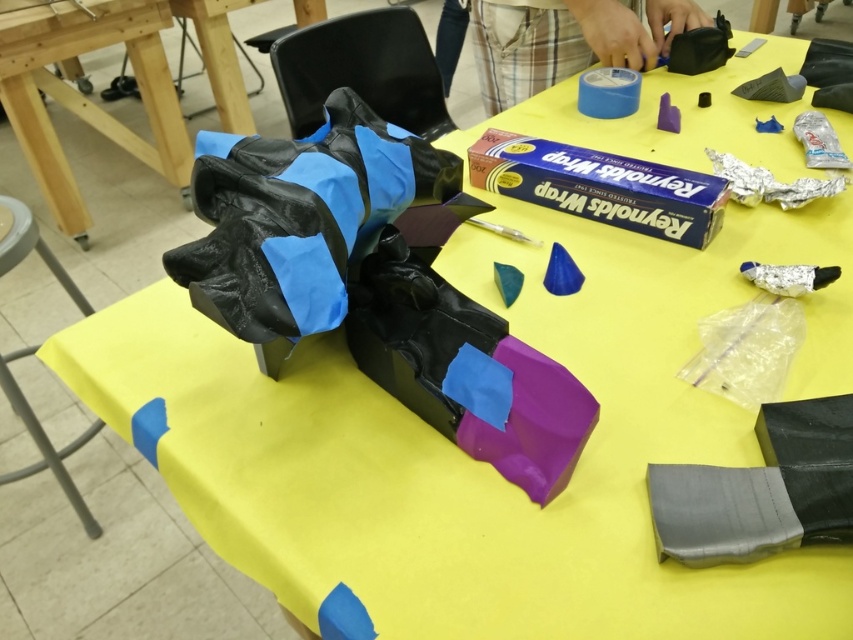
Question: Among these points, which one is farthest from the camera?

Choices:
 (A) (610, 36)
 (B) (20, 136)
 (C) (265, 320)

Answer: (B)

Question: Among these objects, which one is nearest to the camera?

Choices:
 (A) yellow matte table at center
 (B) blue matte tape at upper center

Answer: (B)

Question: Observing the image, what is the correct spatial positioning of matte black glove at center in reference to blue matte tape at upper center?

Choices:
 (A) right
 (B) left

Answer: (B)

Question: Which object is farther from the camera taking this photo?

Choices:
 (A) blue matte tape at upper center
 (B) yellow matte table at center

Answer: (B)

Question: Does matte black glove at center have a smaller size compared to blue matte tape at upper center?

Choices:
 (A) yes
 (B) no

Answer: (A)

Question: Does matte black glove at center appear over yellow matte table at center?

Choices:
 (A) no
 (B) yes

Answer: (A)